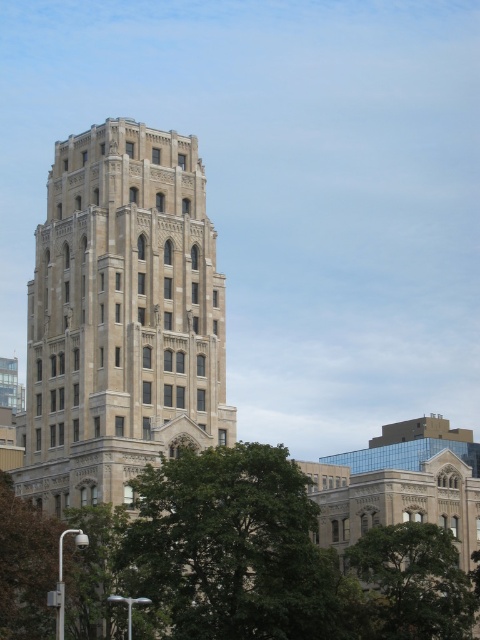
You are standing at the entrance of the tall, ornate building and want to walk towards the green leafy tree at center. Based on your position, is the tree to your left, right, or directly in front of you?

The green leafy tree at center is located at point coordinates that are not provided in the scene description, so I cannot determine its exact direction relative to your position at the entrance. Please provide more details about the spatial layout or coordinate system to assist further.

You are a city planner assessing the width of trees in the image. Which tree, the green leafy tree at center or the green leafy tree at lower left, could potentially block the sidewalk if it grows wider? Please consider their current widths as described.

The green leafy tree at center might block the sidewalk if it grows wider since it is currently wider than the green leafy tree at lower left.